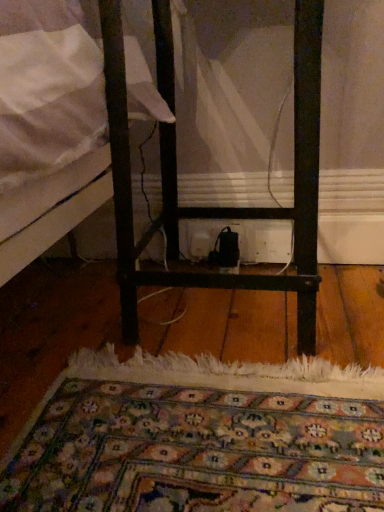
The image size is (384, 512). Find the location of `vacant space to the left of black metal nightstand at center`. vacant space to the left of black metal nightstand at center is located at coordinates (70, 323).